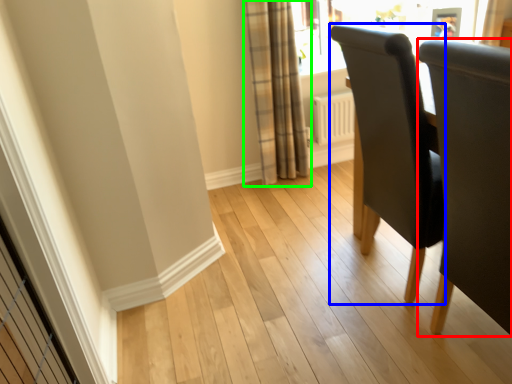
Question: Based on their relative distances, which object is farther from chair (highlighted by a red box)? Choose from chair (highlighted by a blue box) and curtain (highlighted by a green box).

Choices:
 (A) chair
 (B) curtain

Answer: (B)